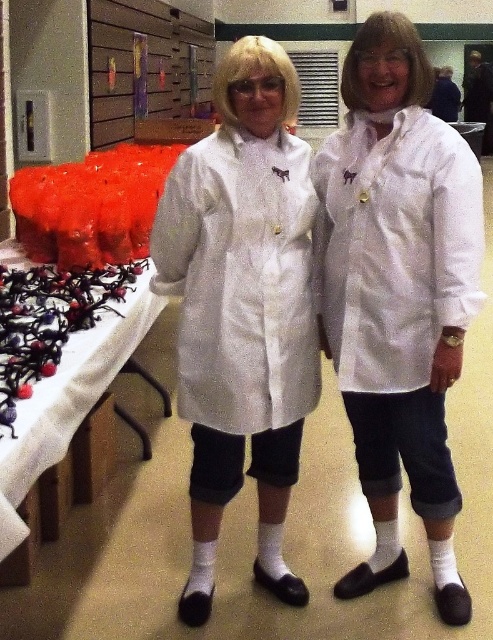
You are organizing a photo shoot and need to ensure proper lighting for the two coats displayed in the image. Since the white fabric lab coat at center and the white textured coat at center are both central to the composition, where should you position the main light to best highlight both coats without casting harsh shadows?

The white fabric lab coat at center is located below the white textured coat at center. To highlight both coats without harsh shadows, position the main light above the white textured coat at center so it illuminates both coats evenly.